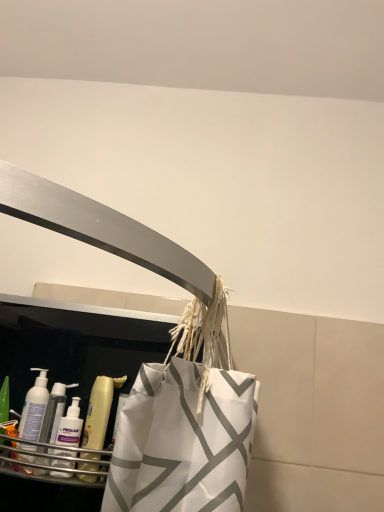
Describe the element at coordinates (99, 411) in the screenshot. The image size is (384, 512). I see `translucent plastic mouthwash at lower left` at that location.

Based on the photo, measure the distance between point (58, 415) and camera.

Point (58, 415) and camera are 38.46 inches apart.

At what (x,y) coordinates should I click in order to perform the action: click on translucent plastic mouthwash at lower left. Please return your answer as a coordinate pair (x, y). The height and width of the screenshot is (512, 384). Looking at the image, I should click on (99, 411).

Is translucent plastic mouthwash at lower left shorter than white plastic bottle at lower left, which is the 1th cleaning product in left-to-right order?

No.

Is translucent plastic mouthwash at lower left aimed at white plastic bottle at lower left, which is the 1th cleaning product in left-to-right order?

No, translucent plastic mouthwash at lower left is not oriented towards white plastic bottle at lower left, which is the 1th cleaning product in left-to-right order.

Is translucent plastic mouthwash at lower left positioned far away from white plastic bottle at lower left, which is the 1th cleaning product in left-to-right order?

No, translucent plastic mouthwash at lower left is in close proximity to white plastic bottle at lower left, which is the 1th cleaning product in left-to-right order.

Is translucent plastic mouthwash at lower left not inside white plastic bottle at lower left, which is the second cleaning product from right to left?

Absolutely, translucent plastic mouthwash at lower left is external to white plastic bottle at lower left, which is the second cleaning product from right to left.

Is translucent plastic mouthwash at lower left placed right next to translucent plastic bottle at left, marked as the second cleaning product in a left-to-right arrangement?

Yes, translucent plastic mouthwash at lower left is right next to translucent plastic bottle at left, marked as the second cleaning product in a left-to-right arrangement, and making contact.

From the image's perspective, is translucent plastic mouthwash at lower left located beneath translucent plastic bottle at left, which is counted as the 1th cleaning product, starting from the right?

Actually, translucent plastic mouthwash at lower left appears above translucent plastic bottle at left, which is counted as the 1th cleaning product, starting from the right, in the image.

Can you confirm if translucent plastic mouthwash at lower left is taller than translucent plastic bottle at left, marked as the second cleaning product in a left-to-right arrangement?

Yes, translucent plastic mouthwash at lower left is taller than translucent plastic bottle at left, marked as the second cleaning product in a left-to-right arrangement.

In the image, is translucent plastic bottle at left, which is counted as the 1th cleaning product, starting from the right, positioned in front of or behind translucent plastic mouthwash at lower left?

translucent plastic bottle at left, which is counted as the 1th cleaning product, starting from the right, is behind translucent plastic mouthwash at lower left.

In the scene shown: Which is less distant, (x=50, y=414) or (x=122, y=380)?

Positioned in front is point (x=122, y=380).

Find the location of a particular element. The height and width of the screenshot is (512, 384). cleaning product below the translucent plastic mouthwash at lower left (from the image's perspective) is located at coordinates (54, 412).

Which of these two, translucent plastic bottle at left, marked as the second cleaning product in a left-to-right arrangement, or translucent plastic mouthwash at lower left, is smaller?

With smaller size is translucent plastic bottle at left, marked as the second cleaning product in a left-to-right arrangement.

Is white plastic bottle at lower left, which is the 1th cleaning product in left-to-right order, looking in the opposite direction of translucent plastic mouthwash at lower left?

No, white plastic bottle at lower left, which is the 1th cleaning product in left-to-right order, is not facing away from translucent plastic mouthwash at lower left.

From the image's perspective, which is above, white plastic bottle at lower left, which is the second cleaning product from right to left, or translucent plastic mouthwash at lower left?

From the image's view, white plastic bottle at lower left, which is the second cleaning product from right to left, is above.

Which is in front, point (42, 387) or point (94, 442)?

The point (94, 442) is closer to the camera.

Looking at this image, is white plastic bottle at lower left, which is the 1th cleaning product in left-to-right order, situated inside translucent plastic mouthwash at lower left or outside?

white plastic bottle at lower left, which is the 1th cleaning product in left-to-right order, cannot be found inside translucent plastic mouthwash at lower left.

How different are the orientations of translucent plastic bottle at left, marked as the second cleaning product in a left-to-right arrangement, and white plastic bottle at lower left, which is the 1th cleaning product in left-to-right order, in degrees?

0.000357 degrees.

From a real-world perspective, relative to white plastic bottle at lower left, which is the second cleaning product from right to left, is translucent plastic bottle at left, which is counted as the 1th cleaning product, starting from the right, vertically above or below?

From a real-world perspective, translucent plastic bottle at left, which is counted as the 1th cleaning product, starting from the right, is physically below white plastic bottle at lower left, which is the second cleaning product from right to left.

Is point (55, 408) closer or farther from the camera than point (27, 412)?

Point (55, 408) is farther from the camera than point (27, 412).

From a real-world perspective, is white plastic bottle at lower left, which is the second cleaning product from right to left, physically above translucent plastic bottle at left, which is counted as the 1th cleaning product, starting from the right?

Yes.

Is white plastic bottle at lower left, which is the 1th cleaning product in left-to-right order, looking in the opposite direction of translucent plastic bottle at left, marked as the second cleaning product in a left-to-right arrangement?

Answer: white plastic bottle at lower left, which is the 1th cleaning product in left-to-right order, does not have its back to translucent plastic bottle at left, marked as the second cleaning product in a left-to-right arrangement.

Is white plastic bottle at lower left, which is the 1th cleaning product in left-to-right order, beside translucent plastic bottle at left, which is counted as the 1th cleaning product, starting from the right?

Indeed, white plastic bottle at lower left, which is the 1th cleaning product in left-to-right order, and translucent plastic bottle at left, which is counted as the 1th cleaning product, starting from the right, are beside each other and touching.

What's the angular difference between white plastic bottle at lower left, which is the 1th cleaning product in left-to-right order, and translucent plastic bottle at left, which is counted as the 1th cleaning product, starting from the right,'s facing directions?

0.000357 degrees.

Image resolution: width=384 pixels, height=512 pixels. I want to click on cleaning product above the translucent plastic mouthwash at lower left (from the image's perspective), so click(34, 408).

The image size is (384, 512). Find the location of `cleaning product below the translucent plastic mouthwash at lower left (from the image's perspective)`. cleaning product below the translucent plastic mouthwash at lower left (from the image's perspective) is located at coordinates (54, 412).

Looking at the image, which one is located closer to translucent plastic bottle at left, marked as the second cleaning product in a left-to-right arrangement, white plastic bottle at lower left, which is the second cleaning product from right to left, or translucent plastic mouthwash at lower left?

Based on the image, white plastic bottle at lower left, which is the second cleaning product from right to left, appears to be nearer to translucent plastic bottle at left, marked as the second cleaning product in a left-to-right arrangement.

From the image, which object appears to be farther from translucent plastic mouthwash at lower left, white plastic bottle at lower left, which is the second cleaning product from right to left, or translucent plastic bottle at left, marked as the second cleaning product in a left-to-right arrangement?

white plastic bottle at lower left, which is the second cleaning product from right to left, lies further to translucent plastic mouthwash at lower left than the other object.

In the scene shown: When comparing their distances from white plastic bottle at lower left, which is the 1th cleaning product in left-to-right order, does translucent plastic bottle at left, marked as the second cleaning product in a left-to-right arrangement, or translucent plastic mouthwash at lower left seem closer?

Among the two, translucent plastic bottle at left, marked as the second cleaning product in a left-to-right arrangement, is located nearer to white plastic bottle at lower left, which is the 1th cleaning product in left-to-right order.

Looking at the image, which one is located further to white plastic bottle at lower left, which is the 1th cleaning product in left-to-right order, translucent plastic mouthwash at lower left or translucent plastic bottle at left, marked as the second cleaning product in a left-to-right arrangement?

translucent plastic mouthwash at lower left lies further to white plastic bottle at lower left, which is the 1th cleaning product in left-to-right order, than the other object.

Looking at the image, which one is located further to translucent plastic bottle at left, marked as the second cleaning product in a left-to-right arrangement, translucent plastic mouthwash at lower left or white plastic bottle at lower left, which is the second cleaning product from right to left?

translucent plastic mouthwash at lower left lies further to translucent plastic bottle at left, marked as the second cleaning product in a left-to-right arrangement, than the other object.

Considering their positions, is translucent plastic bottle at left, which is counted as the 1th cleaning product, starting from the right, positioned closer to translucent plastic mouthwash at lower left than white plastic bottle at lower left, which is the second cleaning product from right to left?

The object closer to translucent plastic mouthwash at lower left is translucent plastic bottle at left, which is counted as the 1th cleaning product, starting from the right.

Where is `cleaning product located between white plastic bottle at lower left, which is the second cleaning product from right to left, and translucent plastic mouthwash at lower left in the left-right direction`? Image resolution: width=384 pixels, height=512 pixels. cleaning product located between white plastic bottle at lower left, which is the second cleaning product from right to left, and translucent plastic mouthwash at lower left in the left-right direction is located at coordinates (54, 412).